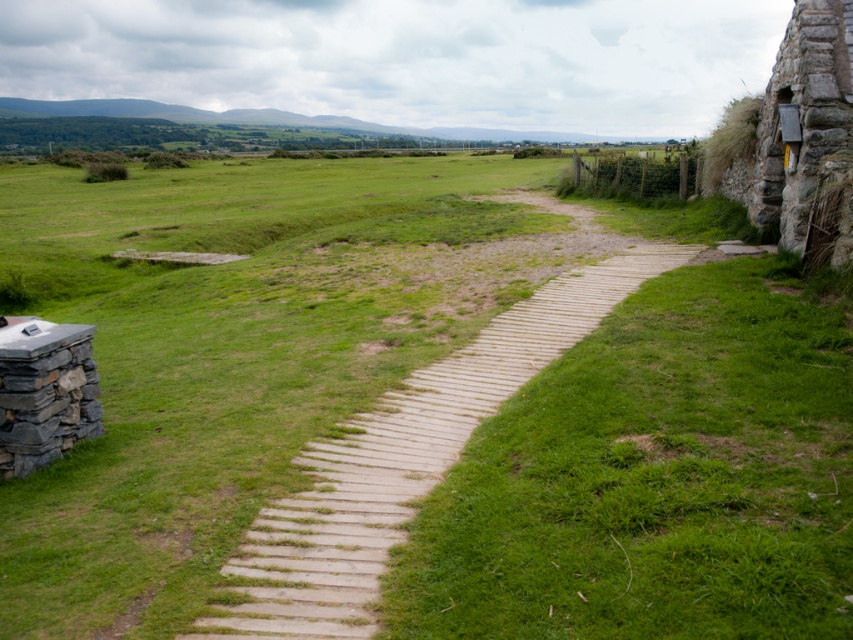
You are standing at the entrance of a rural landscape and see the green grassy at center and the light brown wooden path at center. Which one is closer to you?

The green grassy at center is closer to you because it is positioned in front of the light brown wooden path at center.